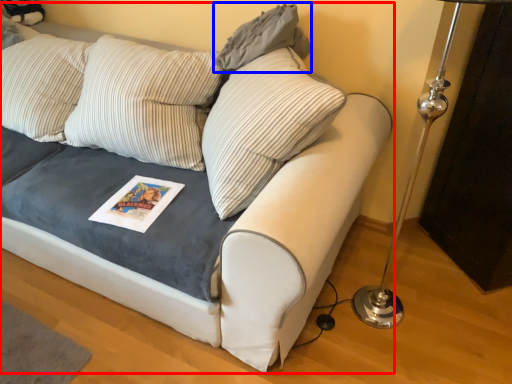
Question: Which object is closer to the camera taking this photo, studio couch (highlighted by a red box) or pillow (highlighted by a blue box)?

Choices:
 (A) studio couch
 (B) pillow

Answer: (A)